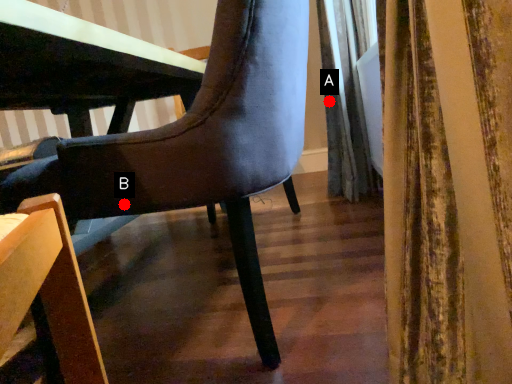
Question: Two points are circled on the image, labeled by A and B beside each circle. Which point is farther from the camera taking this photo?

Choices:
 (A) A is further
 (B) B is further

Answer: (A)